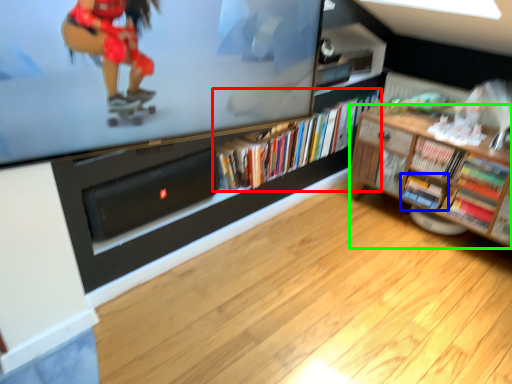
Question: Which object is the closest to the book (highlighted by a red box)? Choose among these: book (highlighted by a blue box) or shelf (highlighted by a green box).

Choices:
 (A) book
 (B) shelf

Answer: (B)